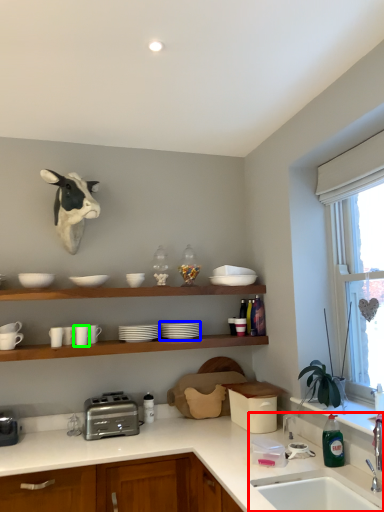
Question: Considering the real-world distances, which object is closest to sink (highlighted by a red box)? tableware (highlighted by a blue box) or tableware (highlighted by a green box).

Choices:
 (A) tableware
 (B) tableware

Answer: (A)